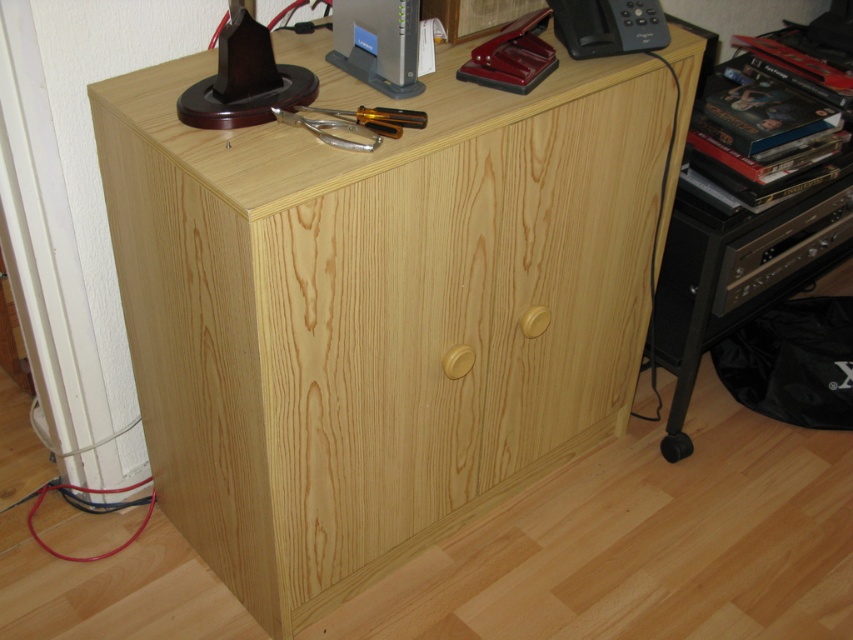
You are organizing a storage space and need to place the natural wood cabinet at center and the black plastic telephone at upper right on a shelf. Which object requires more horizontal space?

The natural wood cabinet at center requires more horizontal space because its width surpasses that of the black plastic telephone at upper right.

You are organizing a storage area and need to place a new item between the natural wood cabinet at center and the black plastic telephone at upper right. Can you fit it vertically between them?

The natural wood cabinet at center is located below the black plastic telephone at upper right, so there is vertical space between them. However, the exact dimensions of the space aren t provided, so it s uncertain if the new item will fit vertically between them.

You are organizing items in a room and need to place a new item on the tallest object in the scene. Which object should you choose between the natural wood cabinet at center and the black plastic telephone at upper right?

The natural wood cabinet at center is taller than the black plastic telephone at upper right, so you should place the new item on the natural wood cabinet at center.